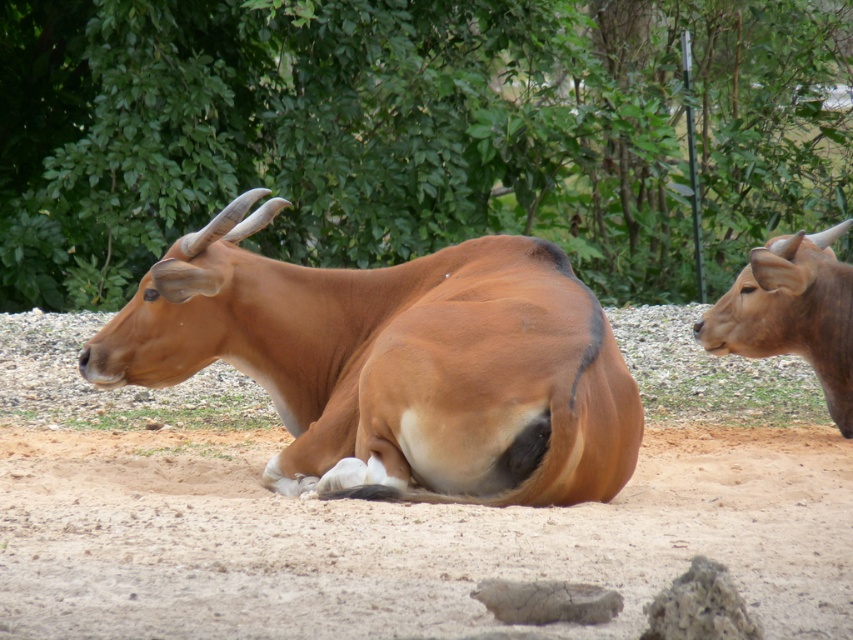
Does point (35, 236) lie behind point (791, 336)?

Yes, point (35, 236) is farther from viewer.

Describe the element at coordinates (415, 132) in the screenshot. This screenshot has width=853, height=640. I see `green leafy tree at upper center` at that location.

Image resolution: width=853 pixels, height=640 pixels. Identify the location of green leafy tree at upper center. (415, 132).

Does green leafy tree at upper center have a lesser width compared to brown smooth cow at center?

Yes, green leafy tree at upper center is thinner than brown smooth cow at center.

Consider the image. Can you confirm if green leafy tree at upper center is positioned to the right of brown smooth cow at center?

In fact, green leafy tree at upper center is to the left of brown smooth cow at center.

Image resolution: width=853 pixels, height=640 pixels. What do you see at coordinates (415, 132) in the screenshot? I see `green leafy tree at upper center` at bounding box center [415, 132].

At what (x,y) coordinates should I click in order to perform the action: click on green leafy tree at upper center. Please return your answer as a coordinate pair (x, y). This screenshot has height=640, width=853. Looking at the image, I should click on (415, 132).

Can you confirm if brown smooth cow at center is bigger than brown matte bull at right?

Yes.

Is brown smooth cow at center below brown matte bull at right?

Yes, brown smooth cow at center is below brown matte bull at right.

Between point (318, 406) and point (814, 300), which one is positioned in front?

Positioned in front is point (318, 406).

Identify the location of brown smooth cow at center. click(x=396, y=365).